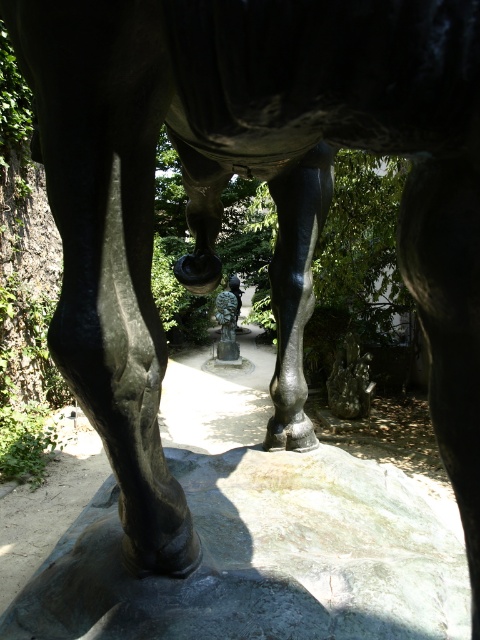
Question: Which point is closer to the camera?

Choices:
 (A) green stone at center
 (B) bronze statue at center

Answer: (A)

Question: Is green stone at center to the left of bronze statue at center from the viewer's perspective?

Choices:
 (A) no
 (B) yes

Answer: (A)

Question: Can you confirm if green stone at center is positioned to the left of bronze statue at center?

Choices:
 (A) no
 (B) yes

Answer: (A)

Question: Can you confirm if green stone at center is bigger than bronze statue at center?

Choices:
 (A) no
 (B) yes

Answer: (B)

Question: Which point is closer to the camera?

Choices:
 (A) bronze statue at center
 (B) green stone at center

Answer: (B)

Question: Which point appears closest to the camera in this image?

Choices:
 (A) pos(219,298)
 (B) pos(462,621)

Answer: (B)